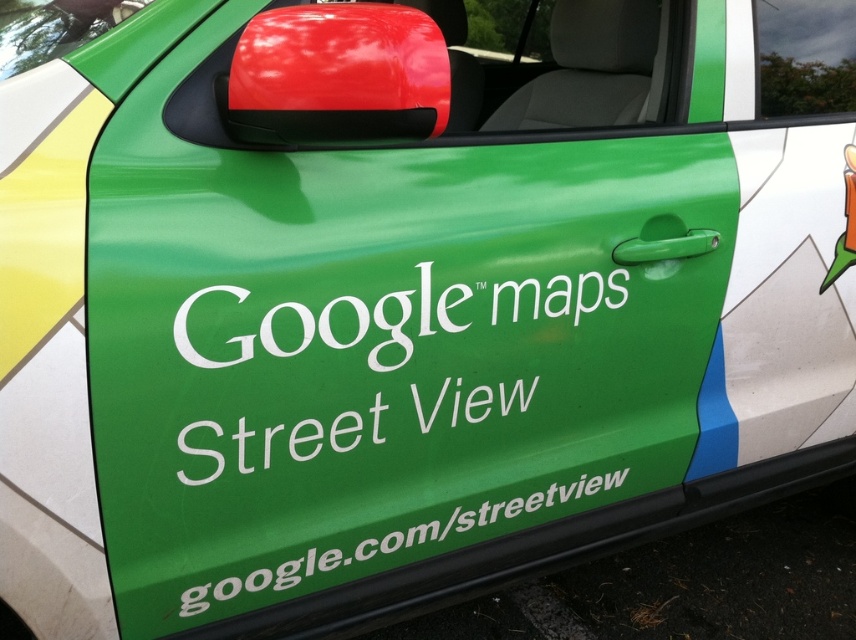
You are a delivery driver who needs to confirm the exact location of the Google Maps Street View car. You see the green matte text at center and the white text on green at lower center on the door. Which text is positioned higher up on the door?

The green matte text at center is positioned higher up on the door because it is above the white text on green at lower center.

You are a graphic designer reviewing the Google Maps Street View car door design. You notice the green matte text at center and the white text on green at lower center. Which text element appears closer to the viewer?

The green matte text at center appears closer to the viewer because it is in front of the white text on green at lower center.